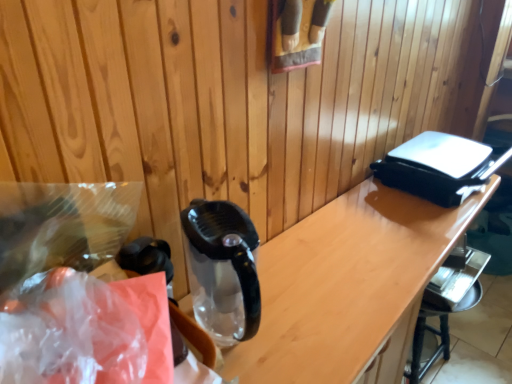
Question: Is transparent plastic bag at left shorter than translucent plastic bag at left?

Choices:
 (A) yes
 (B) no

Answer: (B)

Question: From the image's perspective, is transparent plastic bag at left over translucent plastic bag at left?

Choices:
 (A) yes
 (B) no

Answer: (B)

Question: Considering the relative positions of transparent plastic bag at left and translucent plastic bag at left in the image provided, is transparent plastic bag at left to the right of translucent plastic bag at left from the viewer's perspective?

Choices:
 (A) yes
 (B) no

Answer: (B)

Question: Can you confirm if transparent plastic bag at left is thinner than translucent plastic bag at left?

Choices:
 (A) no
 (B) yes

Answer: (A)

Question: Is transparent plastic bag at left positioned far away from translucent plastic bag at left?

Choices:
 (A) yes
 (B) no

Answer: (B)

Question: Relative to transparent plastic bag at left, is transparent glass table at center in front or behind?

Choices:
 (A) front
 (B) behind

Answer: (B)

Question: From a real-world perspective, is transparent glass table at center positioned above or below transparent plastic bag at left?

Choices:
 (A) above
 (B) below

Answer: (B)

Question: Is transparent glass table at center bigger or smaller than transparent plastic bag at left?

Choices:
 (A) big
 (B) small

Answer: (A)

Question: From the image's perspective, relative to transparent plastic bag at left, is transparent glass table at center above or below?

Choices:
 (A) below
 (B) above

Answer: (A)

Question: Do you think metallic silver bar stool at lower right is within transparent plastic bag at left, or outside of it?

Choices:
 (A) outside
 (B) inside

Answer: (A)

Question: In terms of width, does metallic silver bar stool at lower right look wider or thinner when compared to transparent plastic bag at left?

Choices:
 (A) thin
 (B) wide

Answer: (A)

Question: From the image's perspective, is metallic silver bar stool at lower right located above or below transparent plastic bag at left?

Choices:
 (A) above
 (B) below

Answer: (B)

Question: Relative to transparent plastic bag at left, is metallic silver bar stool at lower right in front or behind?

Choices:
 (A) behind
 (B) front

Answer: (A)

Question: From the image's perspective, relative to translucent plastic bag at left, is metallic silver bar stool at lower right above or below?

Choices:
 (A) below
 (B) above

Answer: (A)

Question: Considering the positions of metallic silver bar stool at lower right and translucent plastic bag at left in the image, is metallic silver bar stool at lower right taller or shorter than translucent plastic bag at left?

Choices:
 (A) short
 (B) tall

Answer: (B)